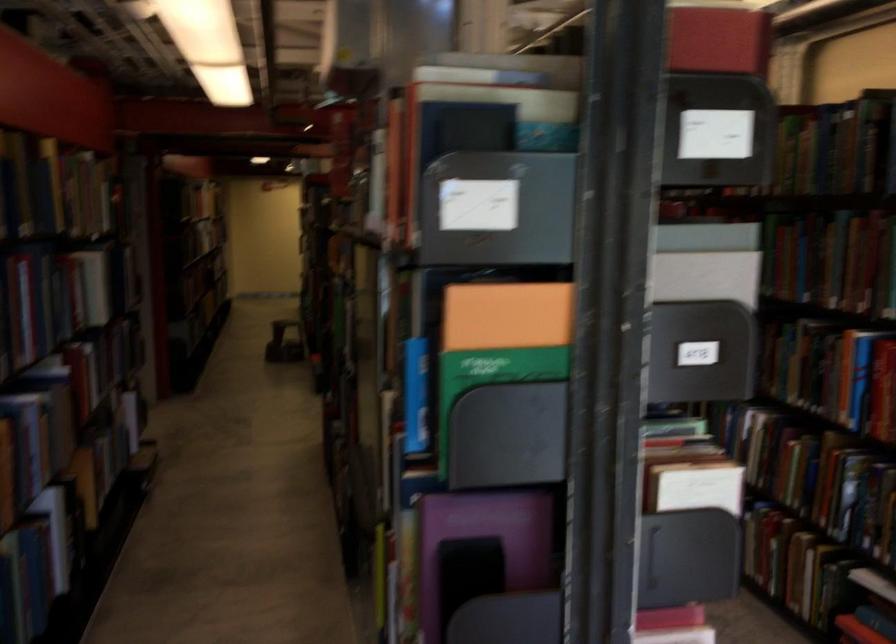
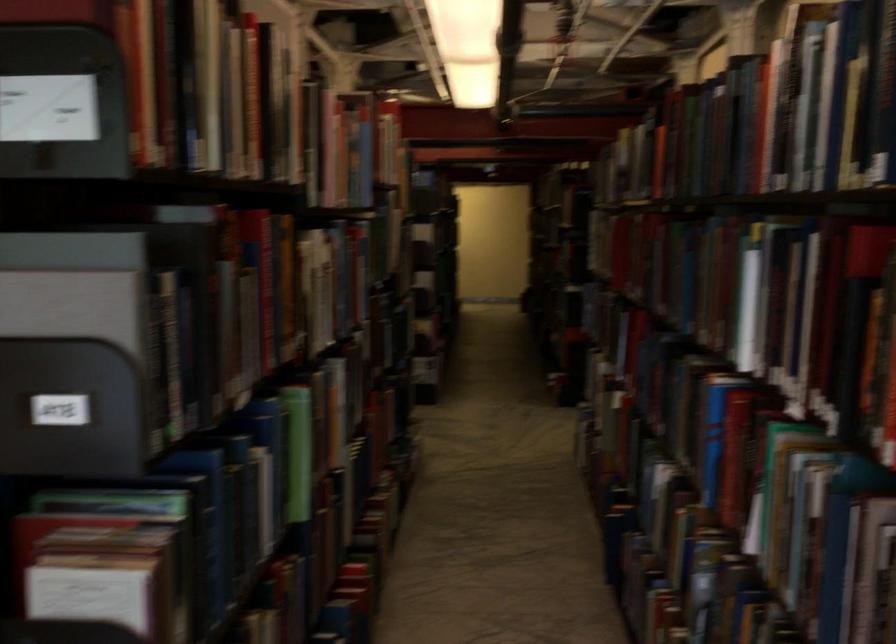
In a continuous first-person perspective shot, in which direction is the camera moving?

The cameraman walked toward right, forward.